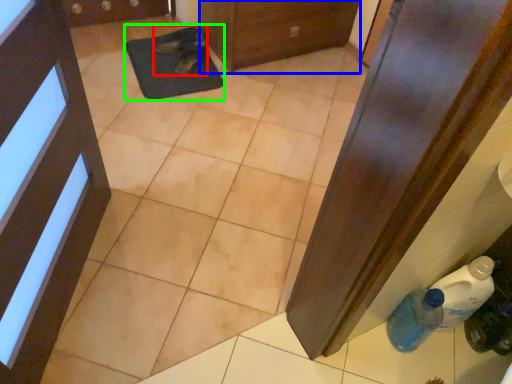
Question: Based on their relative distances, which object is farther from footwear (highlighted by a red box)? Choose from door (highlighted by a blue box) and mat (highlighted by a green box).

Choices:
 (A) door
 (B) mat

Answer: (A)